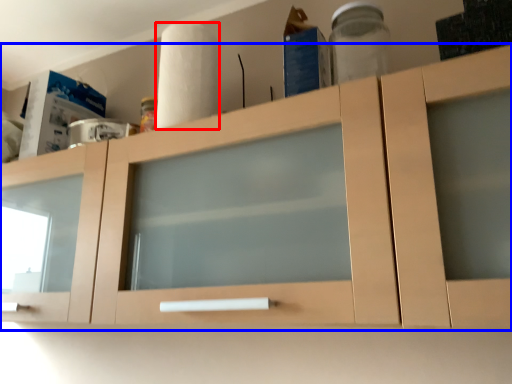
Question: Which object is further to the camera taking this photo, paper towel (highlighted by a red box) or cabinetry (highlighted by a blue box)?

Choices:
 (A) paper towel
 (B) cabinetry

Answer: (A)